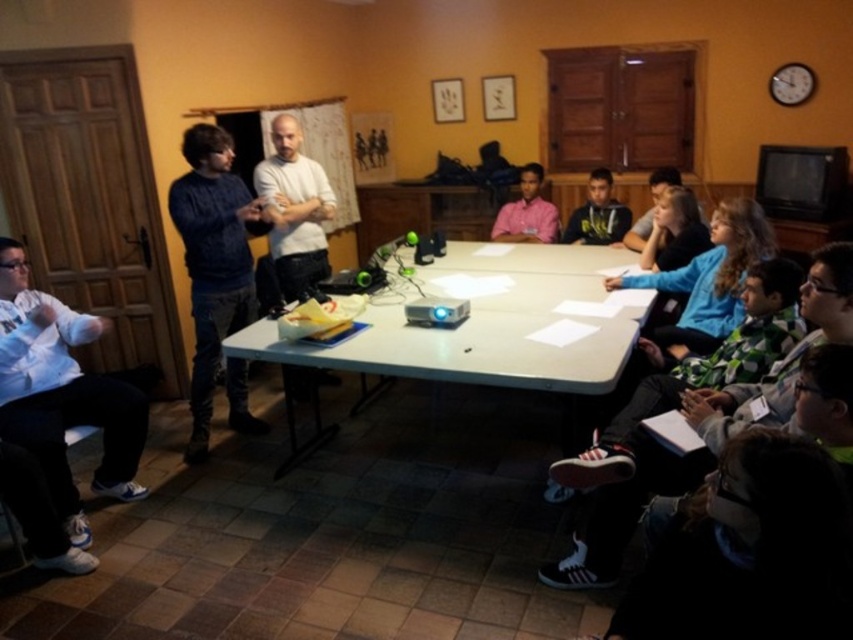
You are a person who is 1.70 meters tall and standing next to the white plastic table at center. You want to reach the white cotton shirt at lower left without moving your feet. Can you do it?

The distance between the white plastic table at center and the white cotton shirt at lower left is 1.30 meters. Since you are 1.70 meters tall, you can stretch your arm to reach the shirt if it is within your arm span. However, the question specifies not moving your feet, so if the shirt is within your reach without moving, then yes. But since the distance is 1.30 meters, which is likely beyond typical arm reach, the answer would be no.

You are a person sitting at the white plastic table at center. You want to hand a pen to the person wearing the white cotton shirt at lower left. Can you reach them without leaving your seat?

The white plastic table at center might be wider than white cotton shirt at lower left, so it is uncertain if you can reach them without leaving your seat.

You are standing at the entrance of the room and want to reach the white plastic table at center. According to the coordinates provided, in which direction should you move relative to your current position?

The white plastic table at center is located at coordinates point [489,326], so you should move forward from the entrance to reach it.